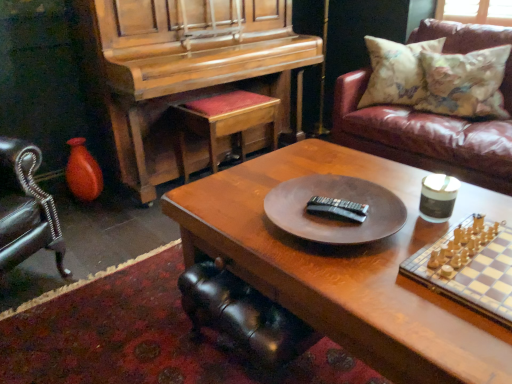
Question: From a real-world perspective, is floral fabric pillow at upper right, positioned as the 2th pillow in right-to-left order, physically above leather couch at upper right?

Choices:
 (A) no
 (B) yes

Answer: (B)

Question: Would you consider floral fabric pillow at upper right, positioned as the 2th pillow in right-to-left order, to be distant from leather couch at upper right?

Choices:
 (A) yes
 (B) no

Answer: (B)

Question: From the image's perspective, is floral fabric pillow at upper right, positioned as the 1th pillow in left-to-right order, beneath leather couch at upper right?

Choices:
 (A) no
 (B) yes

Answer: (A)

Question: Considering the relative sizes of floral fabric pillow at upper right, positioned as the 1th pillow in left-to-right order, and leather couch at upper right in the image provided, is floral fabric pillow at upper right, positioned as the 1th pillow in left-to-right order, shorter than leather couch at upper right?

Choices:
 (A) no
 (B) yes

Answer: (B)

Question: Considering the relative sizes of floral fabric pillow at upper right, positioned as the 2th pillow in right-to-left order, and leather couch at upper right in the image provided, is floral fabric pillow at upper right, positioned as the 2th pillow in right-to-left order, wider than leather couch at upper right?

Choices:
 (A) no
 (B) yes

Answer: (A)

Question: Is floral fabric pillow at upper right, positioned as the 2th pillow in right-to-left order, to the right of leather couch at upper right from the viewer's perspective?

Choices:
 (A) no
 (B) yes

Answer: (A)

Question: Is leather couch at upper right to the left of floral fabric pillow at upper right, arranged as the first pillow when viewed from the right, from the viewer's perspective?

Choices:
 (A) no
 (B) yes

Answer: (B)

Question: From a real-world perspective, is leather couch at upper right below floral fabric pillow at upper right, marked as the second pillow in a left-to-right arrangement?

Choices:
 (A) no
 (B) yes

Answer: (B)

Question: Would you say leather couch at upper right contains floral fabric pillow at upper right, arranged as the first pillow when viewed from the right?

Choices:
 (A) yes
 (B) no

Answer: (A)

Question: Is the position of leather couch at upper right more distant than that of floral fabric pillow at upper right, marked as the second pillow in a left-to-right arrangement?

Choices:
 (A) yes
 (B) no

Answer: (B)

Question: Is leather couch at upper right smaller than floral fabric pillow at upper right, arranged as the first pillow when viewed from the right?

Choices:
 (A) no
 (B) yes

Answer: (A)

Question: Does leather couch at upper right have a lesser height compared to floral fabric pillow at upper right, arranged as the first pillow when viewed from the right?

Choices:
 (A) yes
 (B) no

Answer: (B)

Question: From a real-world perspective, is floral fabric pillow at upper right, arranged as the first pillow when viewed from the right, below leather couch at upper right?

Choices:
 (A) yes
 (B) no

Answer: (B)